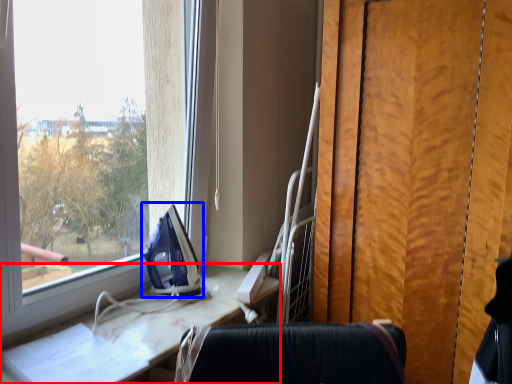
Question: Which object is further to the camera taking this photo, furniture (highlighted by a red box) or equipment (highlighted by a blue box)?

Choices:
 (A) furniture
 (B) equipment

Answer: (B)